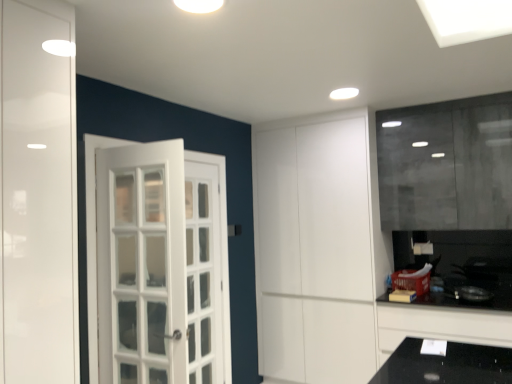
Question: Considering the positions of black glossy countertop at lower right and white matte cabinet at center in the image, is black glossy countertop at lower right bigger or smaller than white matte cabinet at center?

Choices:
 (A) big
 (B) small

Answer: (B)

Question: From a real-world perspective, is black glossy countertop at lower right positioned above or below white matte cabinet at center?

Choices:
 (A) above
 (B) below

Answer: (B)

Question: From the image's perspective, relative to white matte cabinet at center, is black glossy countertop at lower right above or below?

Choices:
 (A) above
 (B) below

Answer: (B)

Question: Considering the positions of white matte cabinet at center and black glossy countertop at lower right in the image, is white matte cabinet at center taller or shorter than black glossy countertop at lower right?

Choices:
 (A) tall
 (B) short

Answer: (A)

Question: Based on their positions, is white matte cabinet at center located to the left or right of black glossy countertop at lower right?

Choices:
 (A) left
 (B) right

Answer: (A)

Question: In terms of size, does white matte cabinet at center appear bigger or smaller than black glossy countertop at lower right?

Choices:
 (A) big
 (B) small

Answer: (A)

Question: Is white matte cabinet at center spatially inside black glossy countertop at lower right, or outside of it?

Choices:
 (A) inside
 (B) outside

Answer: (B)